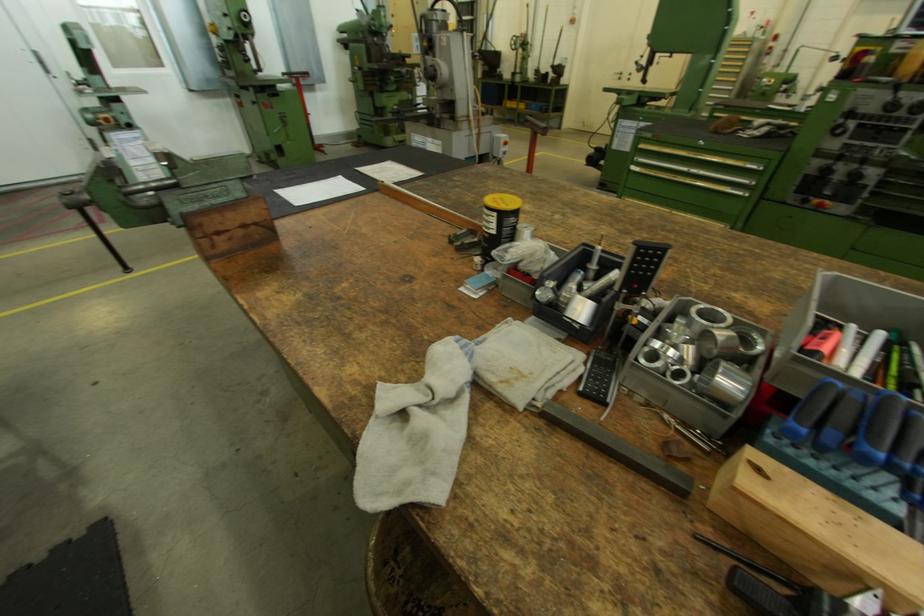
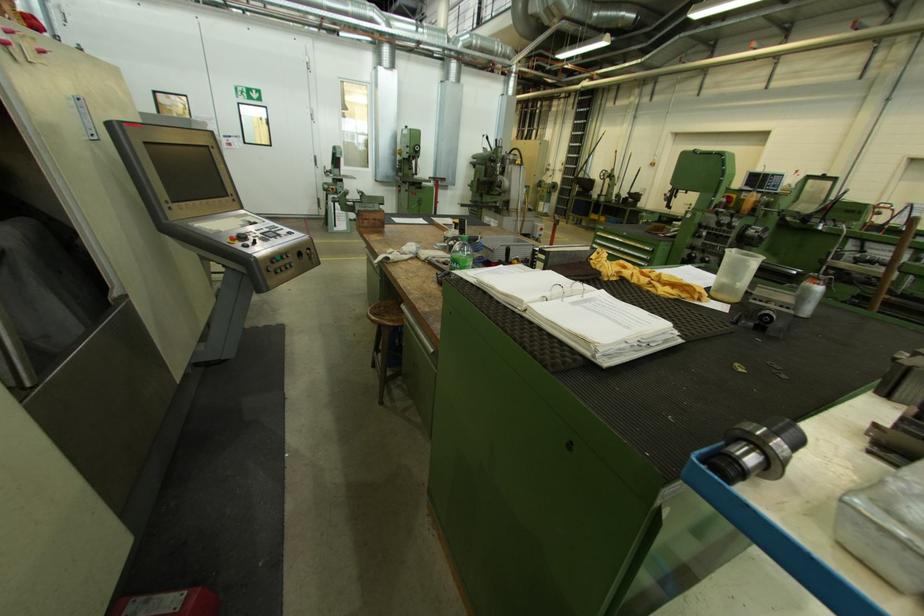
The images are taken continuously from a first-person perspective. In which direction are you moving?

The movement direction of the cameraman is right, backward.